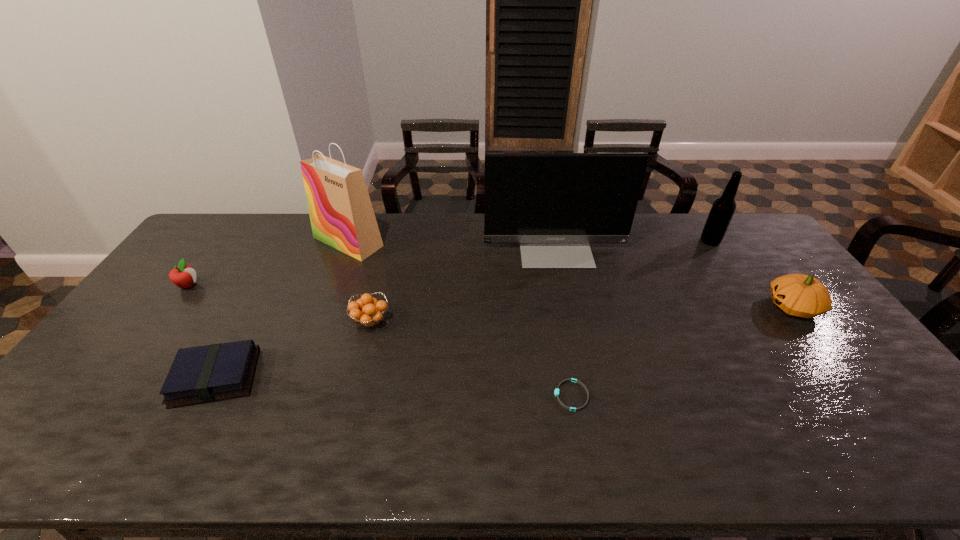
You are a GUI agent. You are given a task and a screenshot of the screen. Output one action in this format:
    pyautogui.click(x=<x>, y=<y>)
    Task: Click on the free space located 0.220m on the buckle of the shortest object
    The width and height of the screenshot is (960, 540).
    Given the screenshot: What is the action you would take?
    pyautogui.click(x=467, y=396)

This screenshot has height=540, width=960. Find the location of `vacant area situated 0.380m on the buckle of the shortest object`. vacant area situated 0.380m on the buckle of the shortest object is located at coordinates (402, 396).

You are a GUI agent. You are given a task and a screenshot of the screen. Output one action in this format:
    pyautogui.click(x=<x>, y=<y>)
    Task: Click on the shopping bag that is at the far edge
    
    Given the screenshot: What is the action you would take?
    pyautogui.click(x=341, y=214)

You are a GUI agent. You are given a task and a screenshot of the screen. Output one action in this format:
    pyautogui.click(x=<x>, y=<y>)
    Task: Click on the computer monitor at the far edge
    This screenshot has width=960, height=540.
    Given the screenshot: What is the action you would take?
    [554, 204]

Locate an element on the screen. beer bottle that is at the far edge is located at coordinates (721, 213).

Find the location of a particular element. This screenshot has width=960, height=540. object situated at the left edge is located at coordinates (184, 276).

Where is `beer bottle that is at the right edge`? This screenshot has height=540, width=960. beer bottle that is at the right edge is located at coordinates (721, 213).

Where is `gourd that is at the right edge`? gourd that is at the right edge is located at coordinates (800, 295).

Find the location of `object located at the far right corner`. object located at the far right corner is located at coordinates (721, 213).

Locate an element on the screen. The width and height of the screenshot is (960, 540). vacant space at the far edge is located at coordinates point(477,232).